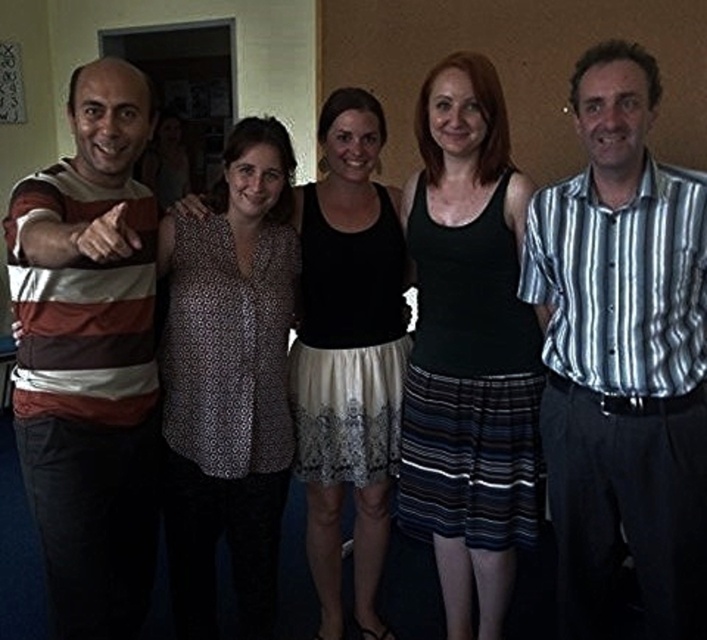
You are a photographer trying to capture a group photo of the striped cotton shirt at left and the striped cotton shirt at right. The camera you are using has a minimum focus distance of 3 feet. Can you take a photo of both shirts at the same time without moving either of them?

The striped cotton shirt at right and striped cotton shirt at left are 3.62 feet apart from each other, which is greater than the camera minimum focus distance of 3 feet. Therefore, you can take a photo of both shirts at the same time without moving them.

Looking at this image, you are standing at the front of the room and want to take a photo of the group. You notice two points marked in the image. The first point is at coordinates point (99, 544) and the second is at point (305, 307). Which point is closer to you when you are facing the group?

Point (99, 544) is in front of point (305, 307), so it is closer to you when facing the group.